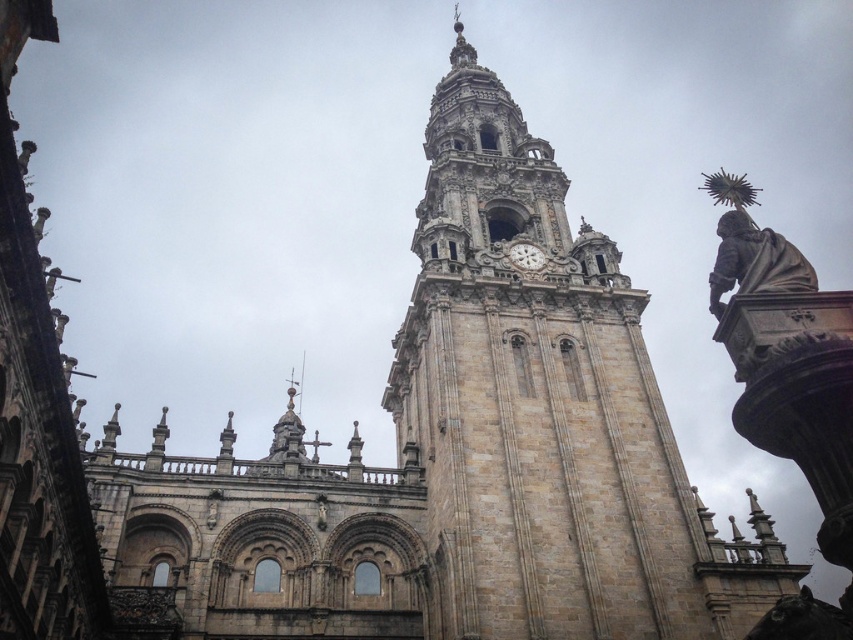
You are an architect examining the cathedral design. You need to place a new decorative element between the bronze statue at right and the white stone clock at center. Based on their current positions, where should you place it to ensure it is centered between them?

The bronze statue at right is positioned on the right side of the white stone clock at center, so placing the new decorative element to the left of the bronze statue at right and to the right of the white stone clock at center would center it between them.

Based on the scene description and the coordinates provided, what object is located at point (532,401)?

The point (532,401) corresponds to the brown stone tower at center.

You are an architect planning to install a new decorative element on the cathedral. You have two options available for placement on the balcony feature mentioned in the scene description. The bronze statue at right and the white stone clock at center. Which object is bigger and thus requires more space?

The bronze statue at right is larger in size compared to the white stone clock at center, so it requires more space for installation.